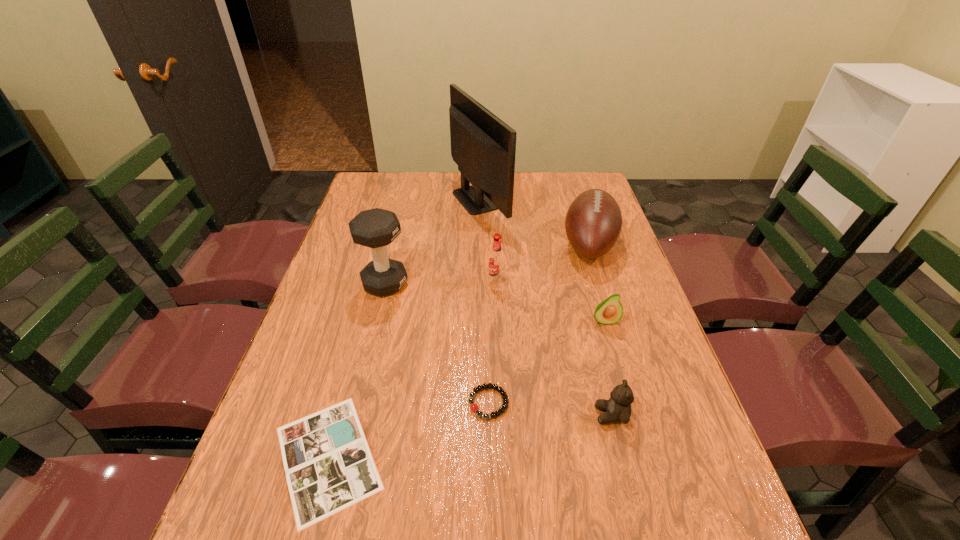
Identify the location of vacant area between the book and the bracelet. This screenshot has width=960, height=540. (408, 430).

This screenshot has width=960, height=540. In order to click on vacant space that is in between the teddy bear and the fourth nearest object in this screenshot , I will do `click(608, 368)`.

At what (x,y) coordinates should I click in order to perform the action: click on free space between the football (American) and the dumbbell. Please return your answer as a coordinate pair (x, y). Looking at the image, I should click on (487, 264).

I want to click on empty space between the teddy bear and the fifth farthest object, so click(x=608, y=368).

You are a GUI agent. You are given a task and a screenshot of the screen. Output one action in this format:
    pyautogui.click(x=<x>, y=<y>)
    Task: Click on the free spot between the tallest object and the teddy bear
    
    Given the screenshot: What is the action you would take?
    pyautogui.click(x=545, y=307)

This screenshot has width=960, height=540. I want to click on vacant space in between the teddy bear and the dumbbell, so click(x=498, y=349).

The width and height of the screenshot is (960, 540). Find the location of `empty location between the bracelet and the avocado`. empty location between the bracelet and the avocado is located at coordinates (547, 362).

Where is `empty space between the root beer and the fifth farthest object`? The width and height of the screenshot is (960, 540). empty space between the root beer and the fifth farthest object is located at coordinates (550, 301).

Point out which object is positioned as the nearest to the book. Please provide its 2D coordinates. Your answer should be formatted as a tuple, i.e. [(x, y)], where the tuple contains the x and y coordinates of a point satisfying the conditions above.

[(499, 389)]

Identify the location of object that can be found as the closest to the tallest object. The height and width of the screenshot is (540, 960). (593, 222).